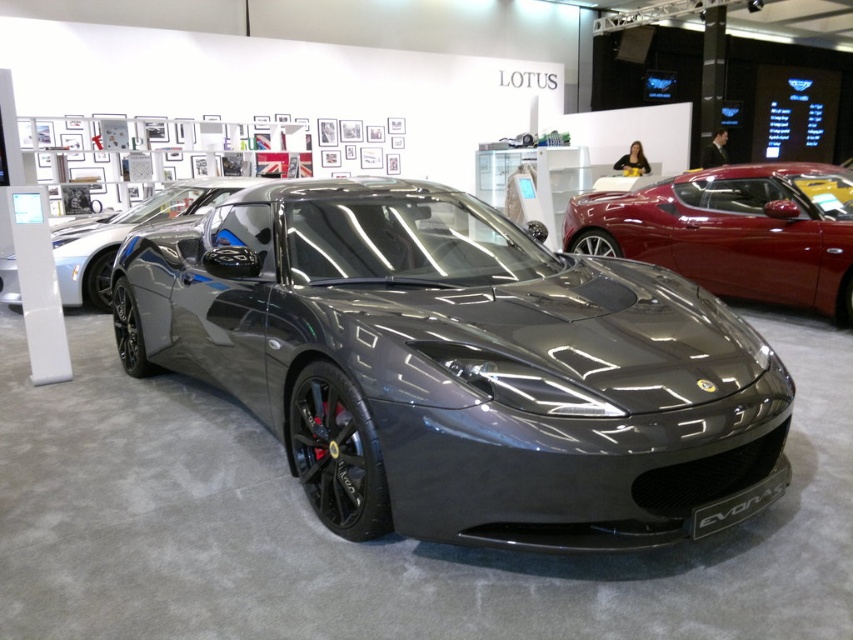
You are at an auto show and see two sports cars displayed. The satin black sports car at center and the glossy metallic sports car at center. Which one is positioned lower in the image?

The satin black sports car at center is positioned lower than the glossy metallic sports car at center in the image.

From the picture: You are a photographer at an auto show, and you need to decide which car to focus on based on their height. The scene has a satin black sports car at center and a glossy metallic sports car at center. Which car should you choose if you want to capture the taller one?

The satin black sports car at center is taller than the glossy metallic sports car at center, so you should choose the satin black sports car at center to capture the taller one.

You are an auto show attendee trying to take a photo of the satin black sports car at center and the glossy metallic sports car at center. Which one should you zoom in more on to capture details?

The satin black sports car at center is larger in size than the glossy metallic sports car at center, so you should zoom in more on the glossy metallic sports car at center to capture its details.